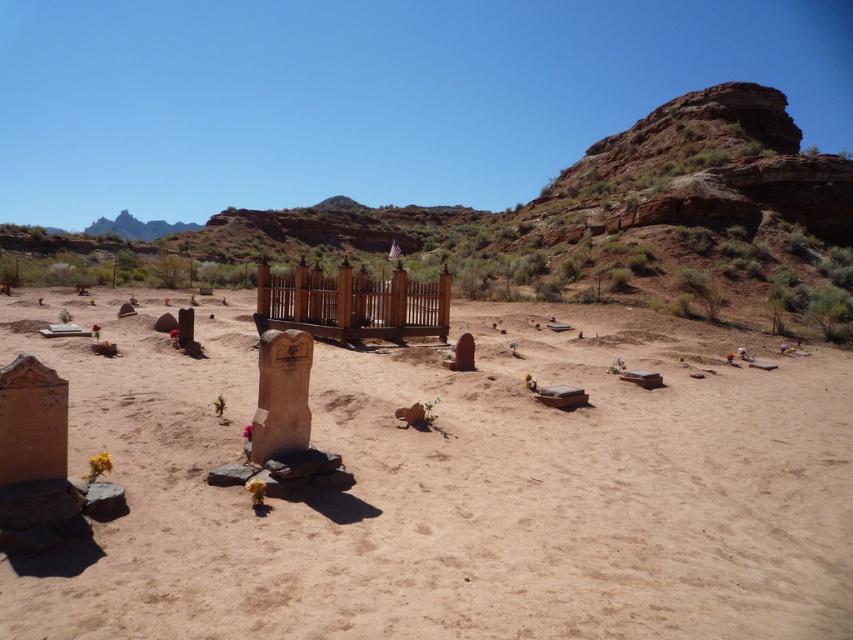
From the picture: You are an archaeologist examining the desert cemetery. You notice the brown sandy dirt field at center and the wooden fence at center. Which object occupies a larger area in the scene?

The wooden fence at center is larger than the brown sandy dirt field at center according to the description.

You are a surveyor who needs to mark the exact location of the brown sandy dirt field at center for a new construction project. According to the coordinates provided, where should you place the marker?

The brown sandy dirt field at center should be marked at the coordinates point (453, 484) as specified in the description.